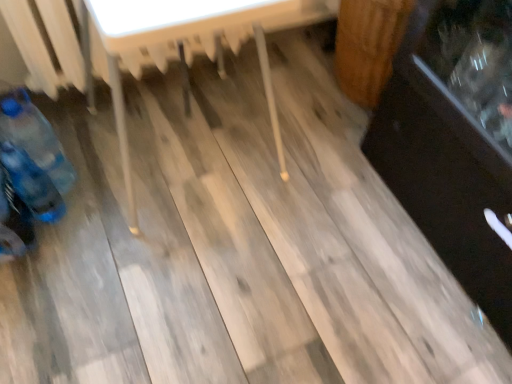
At what (x,y) coordinates should I click in order to perform the action: click on vacant region to the right of blue plastic bottle at lower left, the first bottle in the bottom-to-top sequence. Please return your answer as a coordinate pair (x, y). The width and height of the screenshot is (512, 384). Looking at the image, I should click on (100, 225).